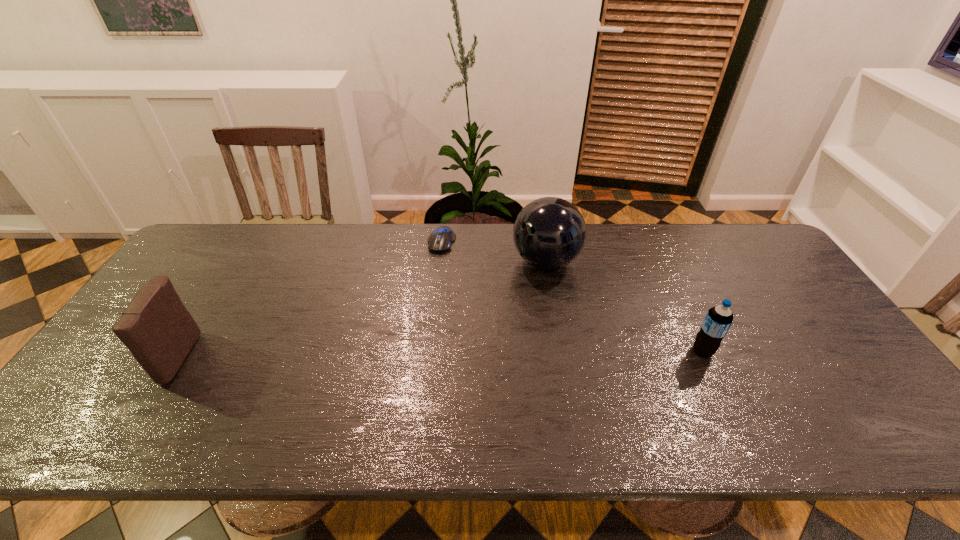
The image size is (960, 540). In order to click on pouch in this screenshot , I will do `click(156, 327)`.

What are the coordinates of `the second shortest object` in the screenshot? It's located at (718, 320).

Image resolution: width=960 pixels, height=540 pixels. What are the coordinates of `the rightmost object` in the screenshot? It's located at (718, 320).

Where is `the third object from right to left`? the third object from right to left is located at coordinates (440, 240).

The height and width of the screenshot is (540, 960). What are the coordinates of `computer mouse` in the screenshot? It's located at (440, 240).

Where is `bowling ball`? The image size is (960, 540). bowling ball is located at coordinates (549, 233).

Where is `vacant space situated with an open flap on the pouch`? This screenshot has height=540, width=960. vacant space situated with an open flap on the pouch is located at coordinates click(x=113, y=357).

Where is `free space located 0.070m with an open flap on the pouch`? This screenshot has height=540, width=960. free space located 0.070m with an open flap on the pouch is located at coordinates (133, 357).

Locate an element on the screen. The height and width of the screenshot is (540, 960). vacant space situated on the back of the soda bottle is located at coordinates (657, 254).

At what (x,y) coordinates should I click in order to perform the action: click on vacant space situated 0.110m on the button side of the second object from left to right. Please return your answer as a coordinate pair (x, y). Looking at the image, I should click on (428, 276).